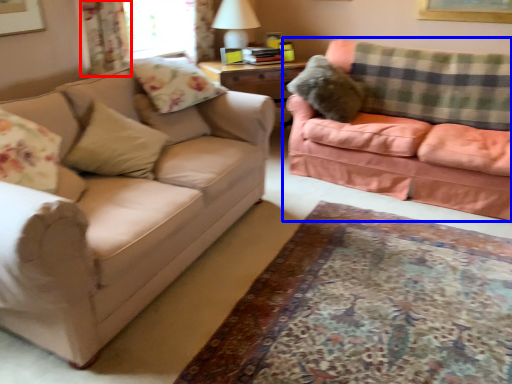
Question: Which object is further to the camera taking this photo, curtain (highlighted by a red box) or studio couch (highlighted by a blue box)?

Choices:
 (A) curtain
 (B) studio couch

Answer: (A)